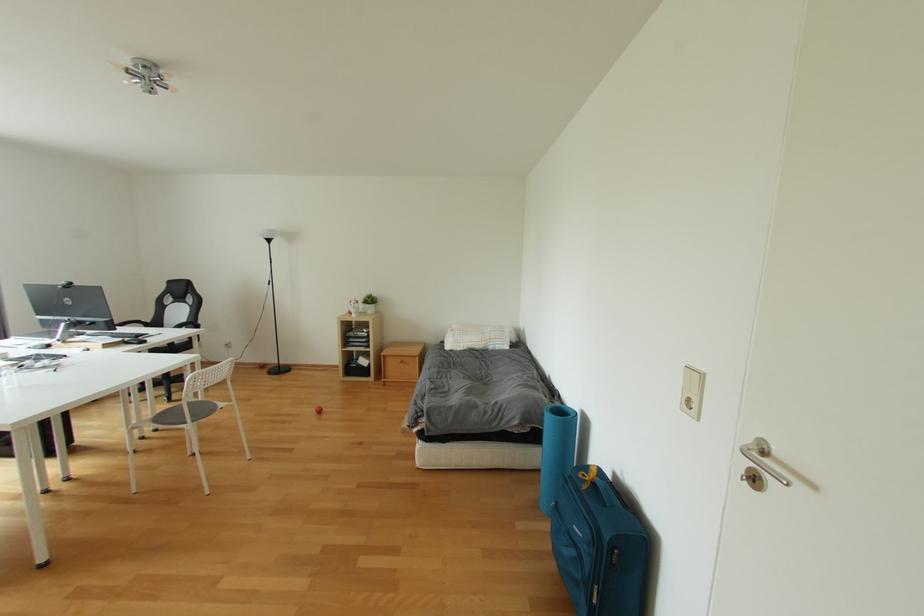
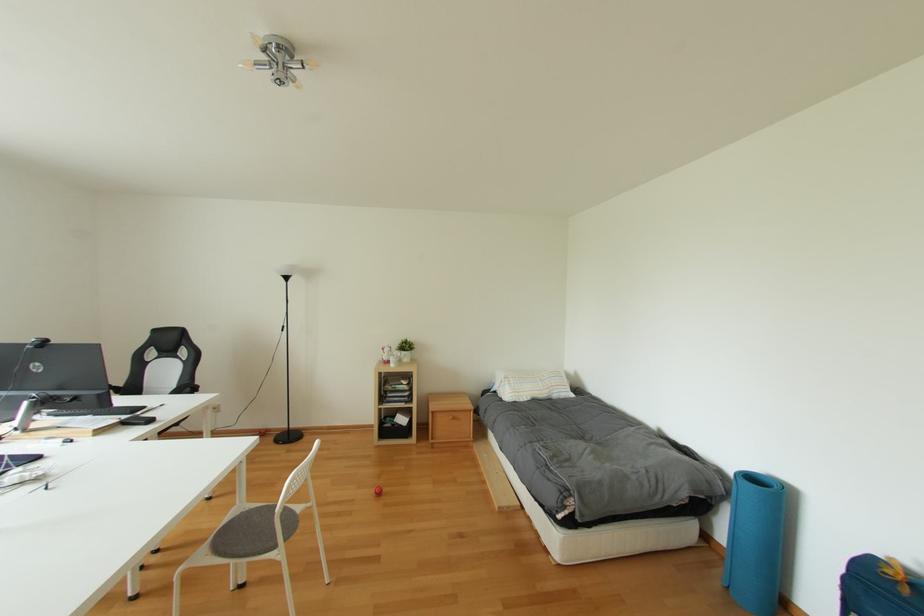
Which direction would the cameraman need to move to produce the second image?

The cameraman walked toward left, forward.